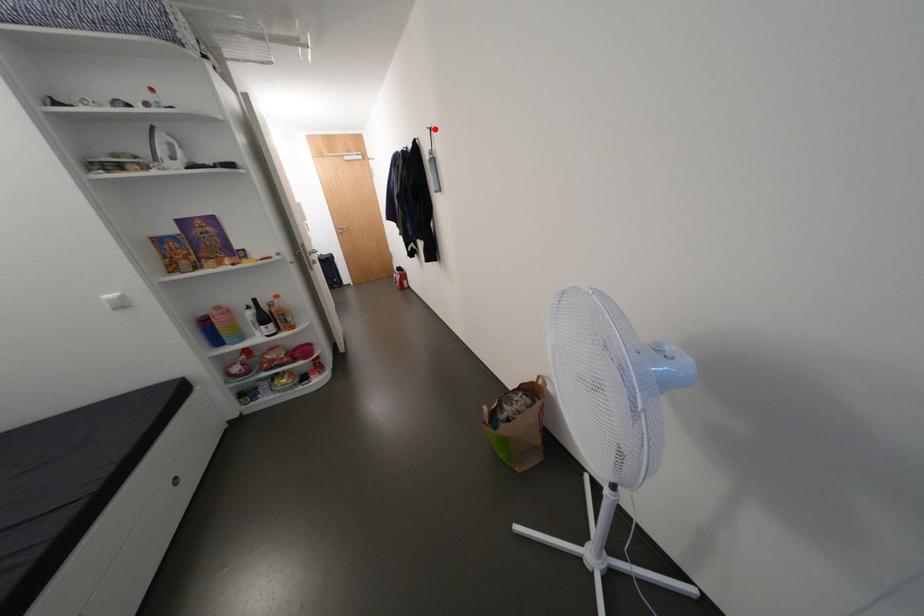
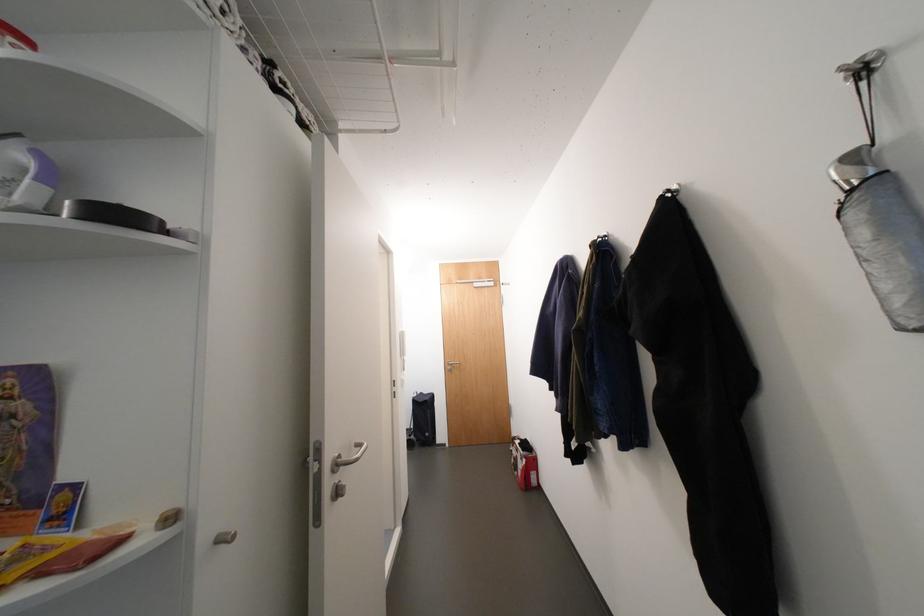
Find the pixel in the second image that matches the highlighted location in the first image.

(855, 71)